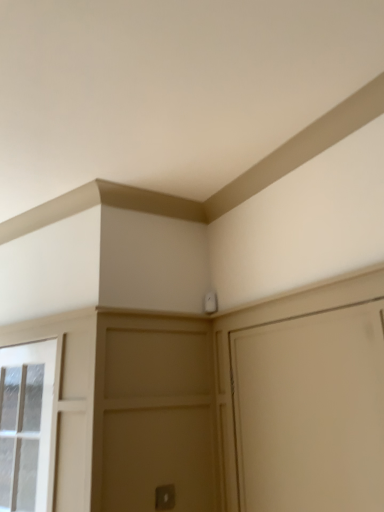
What do you see at coordinates (25, 424) in the screenshot? The image size is (384, 512). I see `clear glass window at left` at bounding box center [25, 424].

Where is `clear glass window at left`? clear glass window at left is located at coordinates (25, 424).

This screenshot has height=512, width=384. Describe the element at coordinates (165, 497) in the screenshot. I see `silver metallic door handle at lower center` at that location.

Locate an element on the screen. The height and width of the screenshot is (512, 384). silver metallic door handle at lower center is located at coordinates (165, 497).

Find the location of a particular element. clear glass window at left is located at coordinates (25, 424).

Is clear glass window at left to the right of silver metallic door handle at lower center from the viewer's perspective?

In fact, clear glass window at left is to the left of silver metallic door handle at lower center.

Is clear glass window at left closer to camera compared to silver metallic door handle at lower center?

That is True.

Considering the points (8, 482) and (171, 490), which point is in front, point (8, 482) or point (171, 490)?

The point (171, 490) is in front.

From the image's perspective, is clear glass window at left located above silver metallic door handle at lower center?

Yes, from the image's perspective, clear glass window at left is over silver metallic door handle at lower center.

From a real-world perspective, between clear glass window at left and silver metallic door handle at lower center, who is vertically lower?

From a 3D spatial view, silver metallic door handle at lower center is below.

Between clear glass window at left and silver metallic door handle at lower center, which one has larger width?

clear glass window at left is wider.

Who is taller, clear glass window at left or silver metallic door handle at lower center?

Standing taller between the two is clear glass window at left.

Which of these two, clear glass window at left or silver metallic door handle at lower center, is smaller?

Smaller between the two is silver metallic door handle at lower center.

Is clear glass window at left inside the boundaries of silver metallic door handle at lower center, or outside?

clear glass window at left is not inside silver metallic door handle at lower center, it's outside.

Is clear glass window at left far from silver metallic door handle at lower center?

No, clear glass window at left is not far from silver metallic door handle at lower center.

Is clear glass window at left oriented towards silver metallic door handle at lower center?

No.

Based on the photo, how different are the orientations of clear glass window at left and silver metallic door handle at lower center in degrees?

The angular difference between clear glass window at left and silver metallic door handle at lower center is 68.4 degrees.

This screenshot has height=512, width=384. I want to click on door handle below the clear glass window at left (from a real-world perspective), so click(165, 497).

Considering the positions of objects silver metallic door handle at lower center and clear glass window at left in the image provided, who is more to the left, silver metallic door handle at lower center or clear glass window at left?

From the viewer's perspective, clear glass window at left appears more on the left side.

Considering the positions of objects silver metallic door handle at lower center and clear glass window at left in the image provided, who is in front, silver metallic door handle at lower center or clear glass window at left?

clear glass window at left is more forward.

Which is behind, point (170, 504) or point (14, 356)?

Point (14, 356)

From the image's perspective, who appears lower, silver metallic door handle at lower center or clear glass window at left?

silver metallic door handle at lower center, from the image's perspective.

From a real-world perspective, who is located higher, silver metallic door handle at lower center or clear glass window at left?

clear glass window at left, from a real-world perspective.

Looking at their sizes, would you say silver metallic door handle at lower center is wider or thinner than clear glass window at left?

Considering their sizes, silver metallic door handle at lower center looks slimmer than clear glass window at left.

From their relative heights in the image, would you say silver metallic door handle at lower center is taller or shorter than clear glass window at left?

In the image, silver metallic door handle at lower center appears to be shorter than clear glass window at left.

Is silver metallic door handle at lower center bigger or smaller than clear glass window at left?

In the image, silver metallic door handle at lower center appears to be smaller than clear glass window at left.

Is silver metallic door handle at lower center completely or partially outside of clear glass window at left?

Yes, silver metallic door handle at lower center is outside of clear glass window at left.

Is silver metallic door handle at lower center beside clear glass window at left?

There is a gap between silver metallic door handle at lower center and clear glass window at left.

Is silver metallic door handle at lower center positioned with its back to clear glass window at left?

No.

What's the angular difference between silver metallic door handle at lower center and clear glass window at left's facing directions?

silver metallic door handle at lower center and clear glass window at left are facing 68.4 degrees away from each other.

Image resolution: width=384 pixels, height=512 pixels. What are the coordinates of `window on the left of silver metallic door handle at lower center` in the screenshot? It's located at (25, 424).

Where is `door handle below the clear glass window at left (from a real-world perspective)`? door handle below the clear glass window at left (from a real-world perspective) is located at coordinates (165, 497).

Locate an element on the screen. door handle on the right of the clear glass window at left is located at coordinates (165, 497).